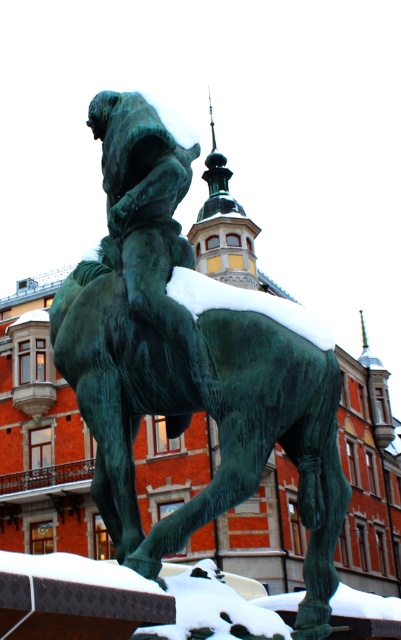
Question: Does green patinated bronze horse at center appear on the right side of green patinated bronze statue at center?

Choices:
 (A) no
 (B) yes

Answer: (A)

Question: Which point appears closest to the camera in this image?

Choices:
 (A) (198, 336)
 (B) (95, 400)

Answer: (A)

Question: Among these objects, which one is nearest to the camera?

Choices:
 (A) green patinated bronze horse at center
 (B) green patinated bronze statue at center

Answer: (A)

Question: Which object appears closest to the camera in this image?

Choices:
 (A) green patinated bronze statue at center
 (B) green patinated bronze horse at center

Answer: (B)

Question: Is green patinated bronze horse at center to the right of green patinated bronze statue at center from the viewer's perspective?

Choices:
 (A) yes
 (B) no

Answer: (B)

Question: Considering the relative positions of green patinated bronze horse at center and green patinated bronze statue at center in the image provided, where is green patinated bronze horse at center located with respect to green patinated bronze statue at center?

Choices:
 (A) left
 (B) right

Answer: (A)